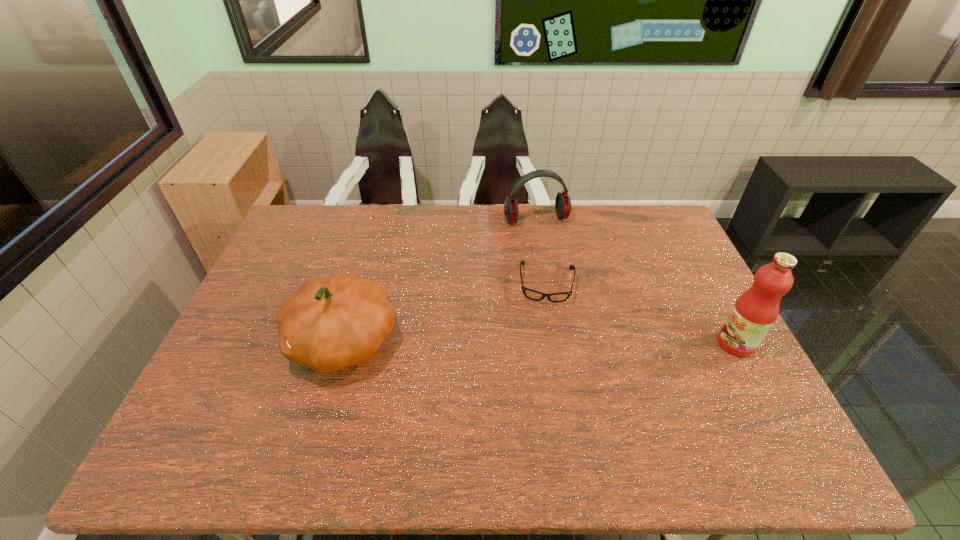
Locate an element on the screen. vacant space located 0.140m on the ear cups of the farthest object is located at coordinates (552, 255).

Locate an element on the screen. blank area located 0.340m on the ear cups of the farthest object is located at coordinates [x=569, y=298].

Where is `vacant area located 0.220m on the ear cups of the farthest object`? Image resolution: width=960 pixels, height=540 pixels. vacant area located 0.220m on the ear cups of the farthest object is located at coordinates (559, 271).

Identify the location of free space located on the front-facing side of the shortest object. (544, 349).

Identify the location of free space located 0.190m on the front-facing side of the shortest object. (544, 358).

Where is `vacant region located on the front-facing side of the shortest object`? This screenshot has height=540, width=960. vacant region located on the front-facing side of the shortest object is located at coordinates (544, 358).

You are a GUI agent. You are given a task and a screenshot of the screen. Output one action in this format:
    pyautogui.click(x=<x>, y=<y>)
    Task: Click on the object that is positioned at the far edge
    
    Given the screenshot: What is the action you would take?
    (562, 203)

The width and height of the screenshot is (960, 540). I want to click on object that is at the near edge, so (x=330, y=323).

Locate an element on the screen. This screenshot has height=540, width=960. object at the left edge is located at coordinates (330, 323).

The image size is (960, 540). What are the coordinates of `object present at the right edge` in the screenshot? It's located at (754, 312).